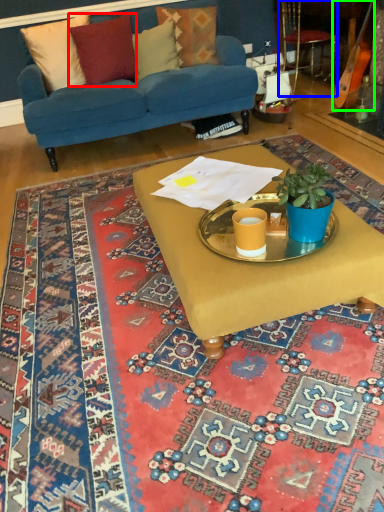
Question: Which object is the farthest from pillow (highlighted by a red box)? Choose among these: armchair (highlighted by a blue box) or instrument (highlighted by a green box).

Choices:
 (A) armchair
 (B) instrument

Answer: (B)